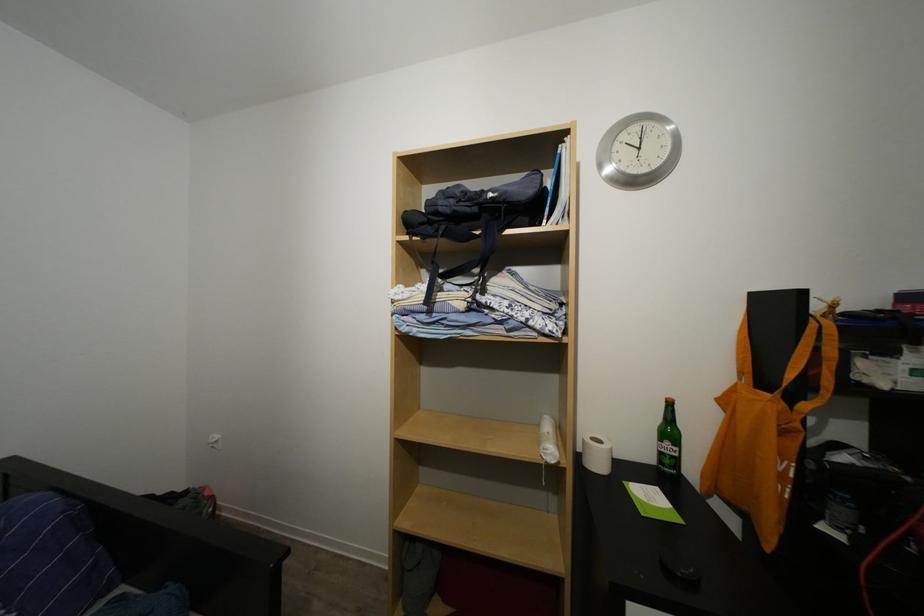
This screenshot has height=616, width=924. What are the coordinates of `toilet paper roll` in the screenshot? It's located at (596, 454).